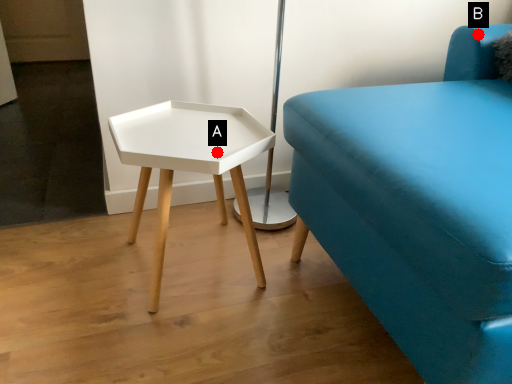
Question: Two points are circled on the image, labeled by A and B beside each circle. Among these points, which one is farthest from the camera?

Choices:
 (A) A is further
 (B) B is further

Answer: (B)